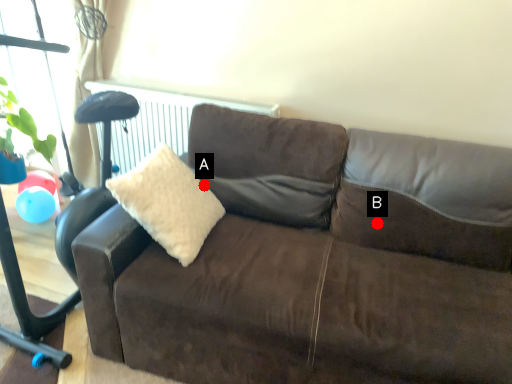
Question: Two points are circled on the image, labeled by A and B beside each circle. Which point is farther from the camera taking this photo?

Choices:
 (A) A is further
 (B) B is further

Answer: (A)